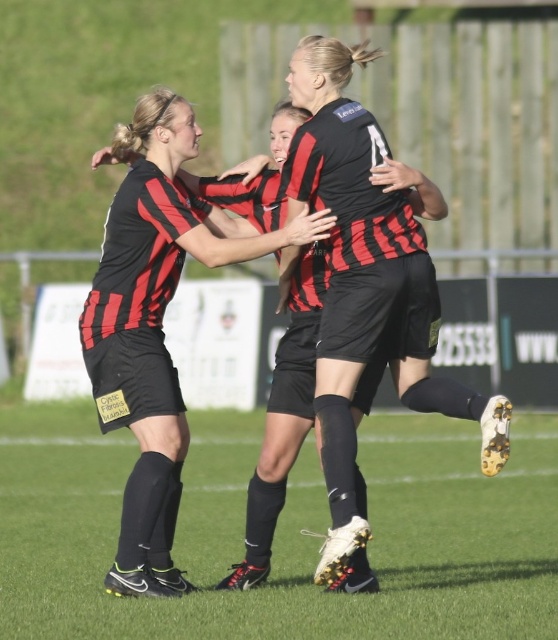
Question: Is the position of black synthetic football boot at lower center less distant than that of matte black soccer uniform at center?

Choices:
 (A) yes
 (B) no

Answer: (A)

Question: Is black synthetic football boot at lower center to the right of matte black soccer uniform at center from the viewer's perspective?

Choices:
 (A) yes
 (B) no

Answer: (A)

Question: Can you confirm if black synthetic football boot at lower center is bigger than matte black soccer uniform at center?

Choices:
 (A) no
 (B) yes

Answer: (B)